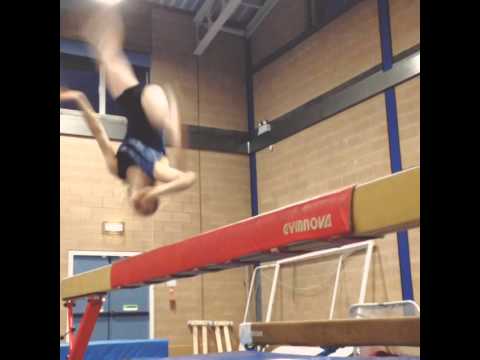
At what (x,y) coordinates should I click in order to perform the action: click on floor mat. Please return your answer as a coordinate pair (x, y). The width and height of the screenshot is (480, 360). Looking at the image, I should click on click(105, 345).